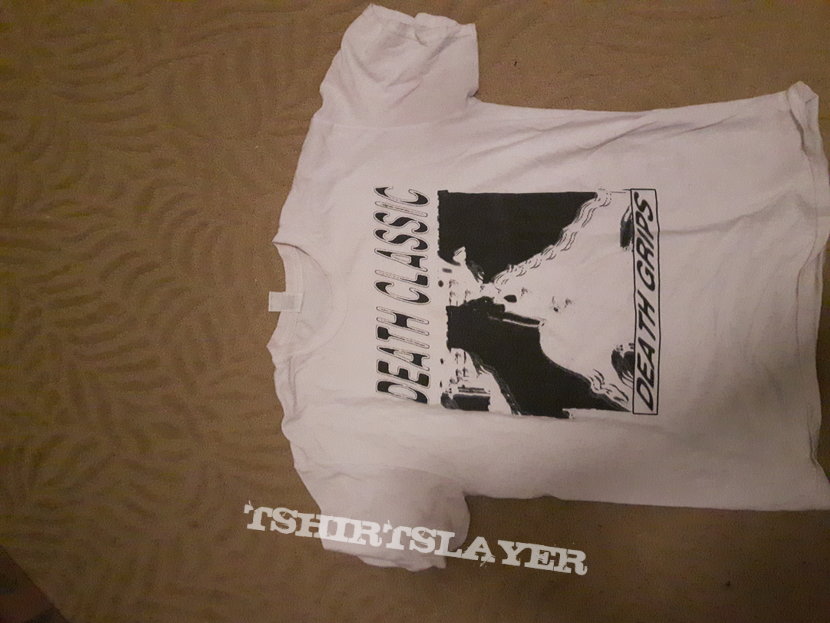
Find the location of `white fabric tag`. white fabric tag is located at coordinates (277, 302).